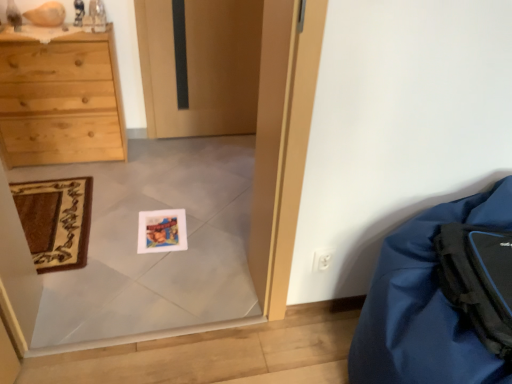
Question: Is blue fabric bean bag at lower right positioned in front of black matte backpack at lower right?

Choices:
 (A) no
 (B) yes

Answer: (B)

Question: Is blue fabric bean bag at lower right next to black matte backpack at lower right and touching it?

Choices:
 (A) no
 (B) yes

Answer: (A)

Question: From a real-world perspective, is blue fabric bean bag at lower right on top of black matte backpack at lower right?

Choices:
 (A) no
 (B) yes

Answer: (A)

Question: Can you confirm if blue fabric bean bag at lower right is bigger than black matte backpack at lower right?

Choices:
 (A) no
 (B) yes

Answer: (B)

Question: From the image's perspective, would you say blue fabric bean bag at lower right is shown under black matte backpack at lower right?

Choices:
 (A) no
 (B) yes

Answer: (B)

Question: Is black matte backpack at lower right at the back of blue fabric bean bag at lower right?

Choices:
 (A) no
 (B) yes

Answer: (A)

Question: Is blue fabric bean bag at lower right completely or partially outside of carpeted mat at lower left?

Choices:
 (A) no
 (B) yes

Answer: (B)

Question: From a real-world perspective, is blue fabric bean bag at lower right beneath carpeted mat at lower left?

Choices:
 (A) yes
 (B) no

Answer: (B)

Question: From a real-world perspective, does blue fabric bean bag at lower right stand above carpeted mat at lower left?

Choices:
 (A) yes
 (B) no

Answer: (A)

Question: Is the depth of blue fabric bean bag at lower right greater than that of carpeted mat at lower left?

Choices:
 (A) no
 (B) yes

Answer: (A)

Question: Considering the relative positions of blue fabric bean bag at lower right and carpeted mat at lower left in the image provided, is blue fabric bean bag at lower right in front of carpeted mat at lower left?

Choices:
 (A) no
 (B) yes

Answer: (B)

Question: Could you tell me if blue fabric bean bag at lower right is facing carpeted mat at lower left?

Choices:
 (A) no
 (B) yes

Answer: (A)

Question: From the image's perspective, is black matte backpack at lower right below blue fabric bean bag at lower right?

Choices:
 (A) no
 (B) yes

Answer: (A)